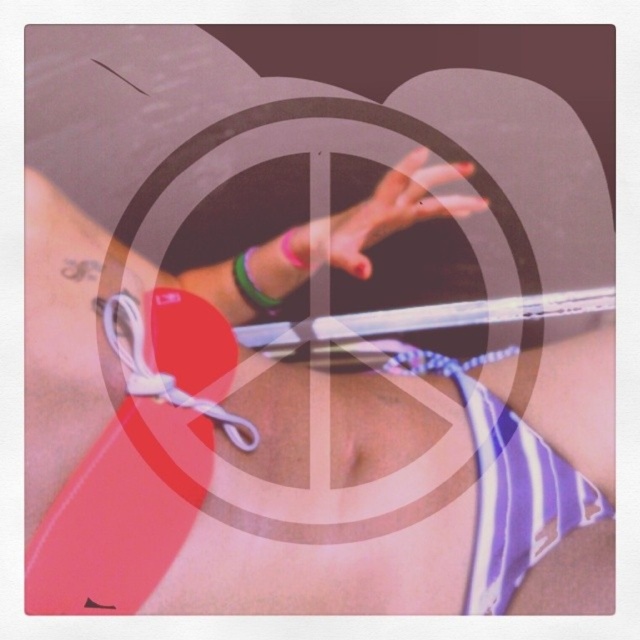
From the picture: Which of these two, striped fabric bikini top at center or white fabric strap at center, stands taller?

striped fabric bikini top at center

Is striped fabric bikini top at center to the left of white fabric strap at center from the viewer's perspective?

Incorrect, striped fabric bikini top at center is not on the left side of white fabric strap at center.

Which is behind, point (458, 381) or point (164, 376)?

Positioned behind is point (458, 381).

The image size is (640, 640). I want to click on striped fabric bikini top at center, so click(x=506, y=483).

Between white fabric strap at center and green rubber bracelet at center, which one appears on the left side from the viewer's perspective?

white fabric strap at center

Is point (134, 323) in front of point (234, 269)?

Yes, it is in front of point (234, 269).

This screenshot has width=640, height=640. In order to click on white fabric strap at center in this screenshot , I will do `click(163, 372)`.

Is striped fabric bikini top at center positioned at the back of green rubber bracelet at upper center?

No, it is in front of green rubber bracelet at upper center.

Which is below, striped fabric bikini top at center or green rubber bracelet at upper center?

striped fabric bikini top at center is below.

What do you see at coordinates (506, 483) in the screenshot?
I see `striped fabric bikini top at center` at bounding box center [506, 483].

Locate an element on the screen. Image resolution: width=640 pixels, height=640 pixels. striped fabric bikini top at center is located at coordinates (506, 483).